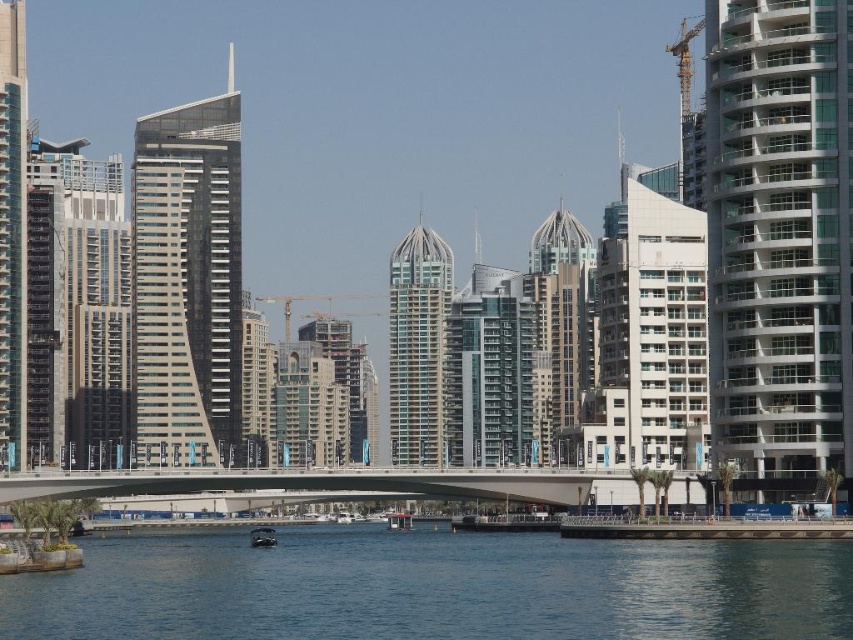
Is sleek glass skyscraper at center thinner than glassy reflective skyscraper at left?

Correct, sleek glass skyscraper at center's width is less than glassy reflective skyscraper at left's.

Does sleek glass skyscraper at center appear on the left side of glassy reflective skyscraper at left?

No, sleek glass skyscraper at center is not to the left of glassy reflective skyscraper at left.

At what (x,y) coordinates should I click in order to perform the action: click on sleek glass skyscraper at center. Please return your answer as a coordinate pair (x, y). Looking at the image, I should click on (418, 346).

Locate an element on the screen. This screenshot has width=853, height=640. white glass building at right is located at coordinates (779, 241).

Who is more forward, (807, 1) or (682, 116)?

Point (807, 1)

Is point (714, 3) positioned before point (665, 51)?

That is True.

Find the location of a particular element. The width and height of the screenshot is (853, 640). white glass building at right is located at coordinates (779, 241).

Is yellow metallic crane at upper right wider than metallic silver boat at lower center?

Correct, the width of yellow metallic crane at upper right exceeds that of metallic silver boat at lower center.

Looking at this image, does yellow metallic crane at upper right have a lesser width compared to metallic silver boat at lower center?

In fact, yellow metallic crane at upper right might be wider than metallic silver boat at lower center.

Between point (683, 38) and point (273, 541), which one is positioned in front?

Point (273, 541) is more forward.

Where is `yellow metallic crane at upper right`? Image resolution: width=853 pixels, height=640 pixels. yellow metallic crane at upper right is located at coordinates (683, 61).